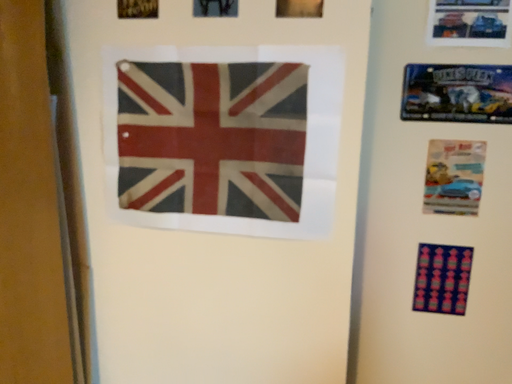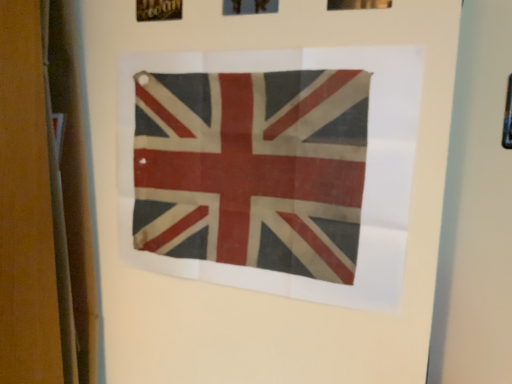
Question: Which way did the camera rotate in the video?

Choices:
 (A) rotated right
 (B) rotated left

Answer: (B)